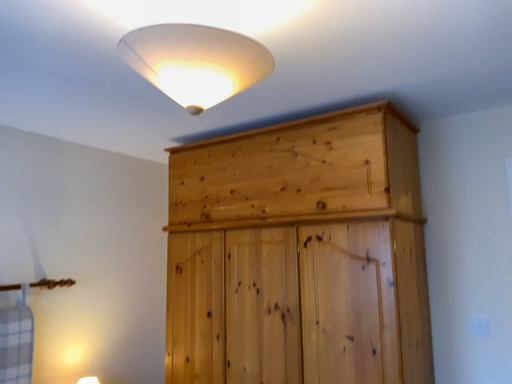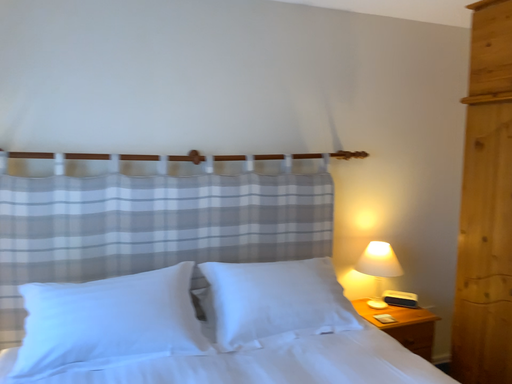
Question: Which way did the camera rotate in the video?

Choices:
 (A) rotated left
 (B) rotated right

Answer: (A)